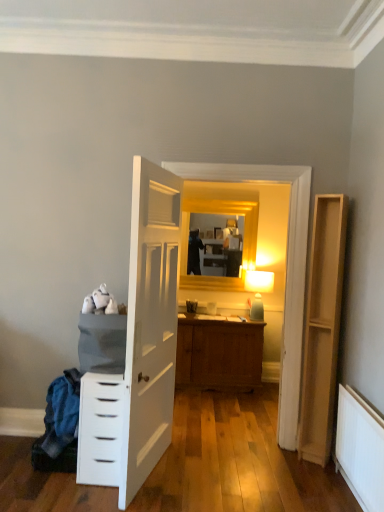
The height and width of the screenshot is (512, 384). I want to click on gold wooden mirror at upper center, so click(222, 214).

What do you see at coordinates (360, 449) in the screenshot?
I see `white painted radiator at lower right` at bounding box center [360, 449].

Locate an element on the screen. The image size is (384, 512). white fabric laundry at lower left is located at coordinates (59, 426).

Locate an element on the screen. white glossy chest of drawers at left is located at coordinates (100, 429).

Is white fabric laundry at lower left in front of or behind light brown wood file cabinet at right in the image?

white fabric laundry at lower left is positioned closer to the viewer than light brown wood file cabinet at right.

From the image's perspective, would you say white fabric laundry at lower left is positioned over light brown wood file cabinet at right?

No, from the image's perspective, white fabric laundry at lower left is not above light brown wood file cabinet at right.

Looking at this image, can you confirm if white fabric laundry at lower left is taller than light brown wood file cabinet at right?

No, white fabric laundry at lower left is not taller than light brown wood file cabinet at right.

Choose the correct answer: Is white fabric laundry at lower left inside light brown wood file cabinet at right or outside it?

white fabric laundry at lower left is outside light brown wood file cabinet at right.

Is white painted radiator at lower right positioned beyond the bounds of gold wooden mirror at upper center?

Yes.

Is point (345, 430) positioned behind point (252, 214)?

No, it is not.

Where is `window above the white painted radiator at lower right (from the image's perspective)`? window above the white painted radiator at lower right (from the image's perspective) is located at coordinates point(222,214).

Consider the image. Is white painted radiator at lower right facing towards gold wooden mirror at upper center?

No, white painted radiator at lower right is not turned towards gold wooden mirror at upper center.

How many degrees apart are the facing directions of gold wooden mirror at upper center and white fabric laundry at lower left?

There is a 5.12-degree angle between the facing directions of gold wooden mirror at upper center and white fabric laundry at lower left.

Is gold wooden mirror at upper center turned away from white fabric laundry at lower left?

gold wooden mirror at upper center does not have its back to white fabric laundry at lower left.

Considering the sizes of objects gold wooden mirror at upper center and white fabric laundry at lower left in the image provided, who is smaller, gold wooden mirror at upper center or white fabric laundry at lower left?

white fabric laundry at lower left is smaller.

Is gold wooden mirror at upper center touching white fabric laundry at lower left?

No, gold wooden mirror at upper center is not in contact with white fabric laundry at lower left.

From the picture: Which of these two, white glossy chest of drawers at left or white painted radiator at lower right, is smaller?

With smaller size is white painted radiator at lower right.

Is white glossy chest of drawers at left positioned with its back to white painted radiator at lower right?

white glossy chest of drawers at left does not have its back to white painted radiator at lower right.

Based on the photo, considering the relative positions of white glossy chest of drawers at left and white painted radiator at lower right in the image provided, is white glossy chest of drawers at left to the right of white painted radiator at lower right from the viewer's perspective?

No, white glossy chest of drawers at left is not to the right of white painted radiator at lower right.

Can you confirm if white painted radiator at lower right is wider than light brown wood file cabinet at right?

No, white painted radiator at lower right is not wider than light brown wood file cabinet at right.

Looking at this image, are white painted radiator at lower right and light brown wood file cabinet at right far apart?

That's not correct — white painted radiator at lower right is a little close to light brown wood file cabinet at right.

Is white painted radiator at lower right positioned with its back to light brown wood file cabinet at right?

No, white painted radiator at lower right is not facing the opposite direction of light brown wood file cabinet at right.

From a real-world perspective, is white fabric laundry at lower left beneath white glossy chest of drawers at left?

Correct, in the physical world, white fabric laundry at lower left is lower than white glossy chest of drawers at left.

Is point (74, 434) positioned behind point (85, 401)?

That is True.

Where is `laundry located below the white glossy chest of drawers at left (from the image's perspective)`? This screenshot has width=384, height=512. laundry located below the white glossy chest of drawers at left (from the image's perspective) is located at coordinates (59, 426).

Considering the relative sizes of white fabric laundry at lower left and white glossy chest of drawers at left in the image provided, is white fabric laundry at lower left bigger than white glossy chest of drawers at left?

Actually, white fabric laundry at lower left might be smaller than white glossy chest of drawers at left.

Is matte green glass at upper center aimed at white painted radiator at lower right?

Yes, matte green glass at upper center is facing white painted radiator at lower right.

Considering the positions of objects matte green glass at upper center and white painted radiator at lower right in the image provided, who is behind, matte green glass at upper center or white painted radiator at lower right?

matte green glass at upper center is more distant.

In the scene shown: Is matte green glass at upper center thinner than white painted radiator at lower right?

Incorrect, the width of matte green glass at upper center is not less than that of white painted radiator at lower right.

Is matte green glass at upper center with white painted radiator at lower right?

matte green glass at upper center and white painted radiator at lower right are not in contact.

The width and height of the screenshot is (384, 512). Identify the location of file cabinet that is above the white fabric laundry at lower left (from a real-world perspective). (322, 327).

Where is `radiator below the gold wooden mirror at upper center (from a real-world perspective)`? This screenshot has width=384, height=512. radiator below the gold wooden mirror at upper center (from a real-world perspective) is located at coordinates (360, 449).

Estimate the real-world distances between objects in this image. Which object is closer to white painted radiator at lower right, matte green glass at upper center or gold wooden mirror at upper center?

The object closer to white painted radiator at lower right is matte green glass at upper center.

Estimate the real-world distances between objects in this image. Which object is further from light brown wood file cabinet at right, matte green glass at upper center or white glossy chest of drawers at left?

The object further to light brown wood file cabinet at right is white glossy chest of drawers at left.

When comparing their distances from light brown wood file cabinet at right, does matte green glass at upper center or white fabric laundry at lower left seem further?

white fabric laundry at lower left.

Considering their positions, is light brown wood file cabinet at right positioned closer to gold wooden mirror at upper center than matte green glass at upper center?

Based on the image, matte green glass at upper center appears to be nearer to gold wooden mirror at upper center.

In the scene shown: When comparing their distances from white painted radiator at lower right, does matte green glass at upper center or white fabric laundry at lower left seem further?

matte green glass at upper center lies further to white painted radiator at lower right than the other object.

Which object lies nearer to the anchor point light brown wood file cabinet at right, white fabric laundry at lower left or matte green glass at upper center?

matte green glass at upper center is positioned closer to the anchor light brown wood file cabinet at right.

When comparing their distances from white glossy chest of drawers at left, does light brown wood file cabinet at right or gold wooden mirror at upper center seem further?

gold wooden mirror at upper center is further to white glossy chest of drawers at left.

Considering their positions, is white glossy chest of drawers at left positioned closer to gold wooden mirror at upper center than matte green glass at upper center?

matte green glass at upper center is closer to gold wooden mirror at upper center.

Where is `chest of drawers between white painted radiator at lower right and gold wooden mirror at upper center along the z-axis`? The width and height of the screenshot is (384, 512). chest of drawers between white painted radiator at lower right and gold wooden mirror at upper center along the z-axis is located at coordinates (100, 429).

Locate an element on the screen. The height and width of the screenshot is (512, 384). file cabinet between white painted radiator at lower right and matte green glass at upper center in the front-back direction is located at coordinates (322, 327).

Locate an element on the screen. This screenshot has width=384, height=512. file cabinet positioned between white glossy chest of drawers at left and matte green glass at upper center from near to far is located at coordinates (322, 327).

Identify the location of the chest of drawers located between white fabric laundry at lower left and white painted radiator at lower right in the left-right direction. This screenshot has width=384, height=512. (100, 429).